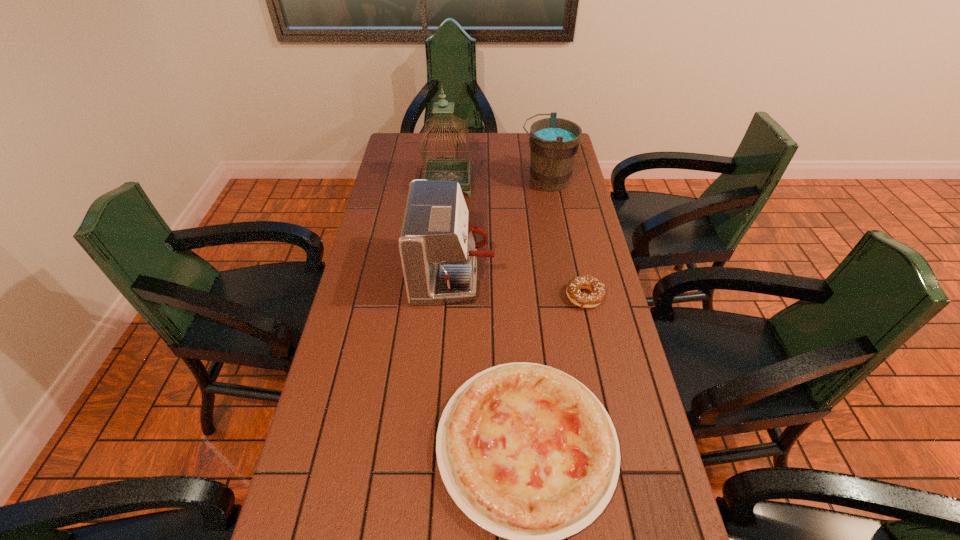
Locate an element on the screen. This screenshot has height=540, width=960. object that stands as the third closest to the tallest object is located at coordinates (597, 288).

In order to click on object that stands as the closest to the coffee maker in this screenshot , I will do `click(527, 452)`.

I want to click on vacant region that satisfies the following two spatial constraints: 1. at the door of the birdcage; 2. on the left side of the doughnut, so click(x=438, y=297).

This screenshot has height=540, width=960. Identify the location of free spot that satisfies the following two spatial constraints: 1. on the front of the coffee maker near the spout; 2. on the right side of the shortest object. (451, 297).

Identify the location of free space that satisfies the following two spatial constraints: 1. at the door of the tallest object; 2. on the right side of the doughnut. The width and height of the screenshot is (960, 540). (438, 297).

I want to click on vacant space that satisfies the following two spatial constraints: 1. at the door of the shortest object; 2. on the left side of the birdcage, so click(438, 297).

The height and width of the screenshot is (540, 960). Identify the location of free space that satisfies the following two spatial constraints: 1. on the front of the coffee maker near the spout; 2. on the left side of the doughnut. (451, 297).

This screenshot has width=960, height=540. What are the coordinates of `free space that satisfies the following two spatial constraints: 1. with a handle on the side of the wine bucket; 2. on the left side of the doughnut` in the screenshot? It's located at (567, 297).